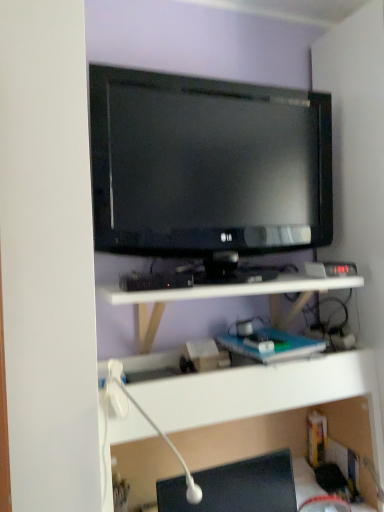
Question: From the image's perspective, is white plastic shelf at lower center, the 2th shelf from the top, above or below white matte shelf at center, which is counted as the first shelf, starting from the top?

Choices:
 (A) below
 (B) above

Answer: (A)

Question: Is white plastic shelf at lower center, the 1th shelf in the bottom-to-top sequence, taller or shorter than white matte shelf at center, which is the second shelf in bottom-to-top order?

Choices:
 (A) short
 (B) tall

Answer: (B)

Question: Which object is positioned farthest from the white matte shelf at center, which is the second shelf in bottom-to-top order?

Choices:
 (A) white plastic shelf at lower center, the 2th shelf from the top
 (B) black glossy desktop at lower right
 (C) matte black tv at upper center
 (D) white plastic lamp at lower center

Answer: (B)

Question: Which object is the closest to the white plastic shelf at lower center, the 1th shelf in the bottom-to-top sequence?

Choices:
 (A) matte black tv at upper center
 (B) black glossy desktop at lower right
 (C) white matte shelf at center, which is the second shelf in bottom-to-top order
 (D) white plastic lamp at lower center

Answer: (C)